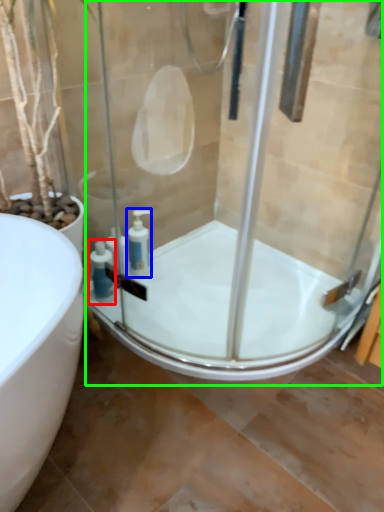
Question: Which object is positioned closest to soap dispenser (highlighted by a red box)? Select from soap dispenser (highlighted by a blue box) and shower door (highlighted by a green box).

Choices:
 (A) soap dispenser
 (B) shower door

Answer: (A)